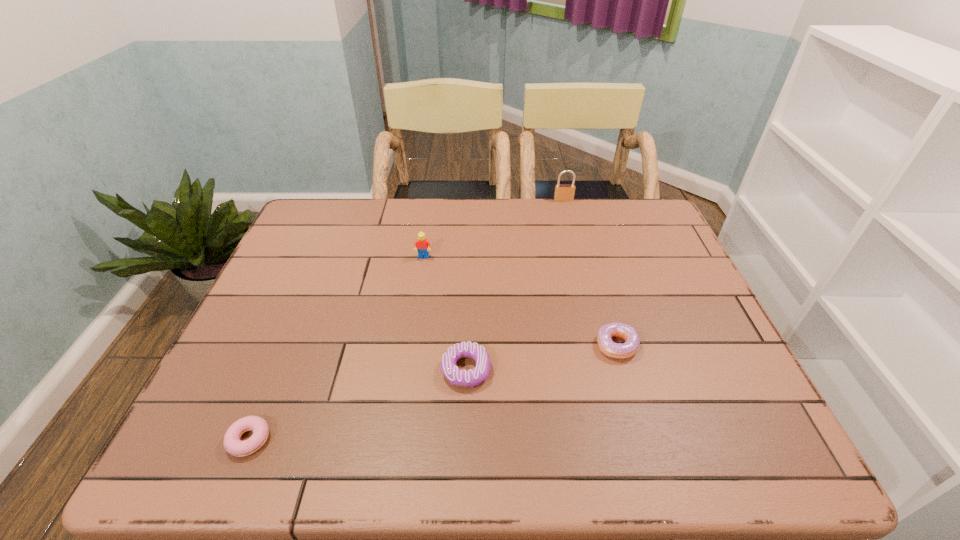
The width and height of the screenshot is (960, 540). In order to click on free location located on the right of the second doughnut from left to right in this screenshot , I will do `click(595, 370)`.

Where is `vacant space situated on the back of the rightmost doughnut`? The height and width of the screenshot is (540, 960). vacant space situated on the back of the rightmost doughnut is located at coordinates (600, 291).

Identify the location of free space located on the back of the nearest doughnut. The width and height of the screenshot is (960, 540). (280, 364).

Identify the location of object present at the far edge. (563, 192).

Image resolution: width=960 pixels, height=540 pixels. I want to click on object present at the near edge, so click(233, 445).

I want to click on object positioned at the left edge, so click(233, 445).

Locate an element on the screen. This screenshot has width=960, height=540. object at the near left corner is located at coordinates (233, 445).

At what (x,y) coordinates should I click in order to perform the action: click on vacant space at the far edge of the desktop. Please return your answer as a coordinate pair (x, y). Looking at the image, I should click on (396, 216).

The image size is (960, 540). In the image, there is a desktop. What are the coordinates of `free space at the near edge` in the screenshot? It's located at (519, 451).

Find the location of a particular element. Image resolution: width=960 pixels, height=540 pixels. free space at the left edge is located at coordinates (305, 308).